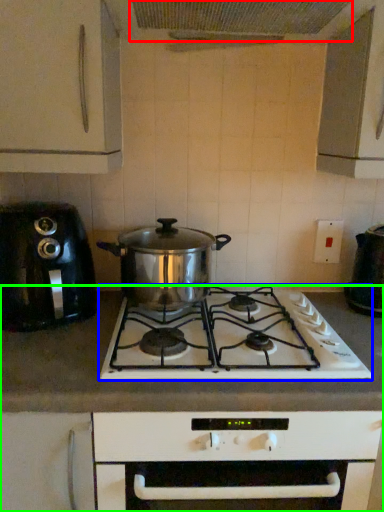
Question: Which object is positioned closest to exhaust hood (highlighted by a red box)? Select from gas stove (highlighted by a blue box) and countertop (highlighted by a green box).

Choices:
 (A) gas stove
 (B) countertop

Answer: (A)